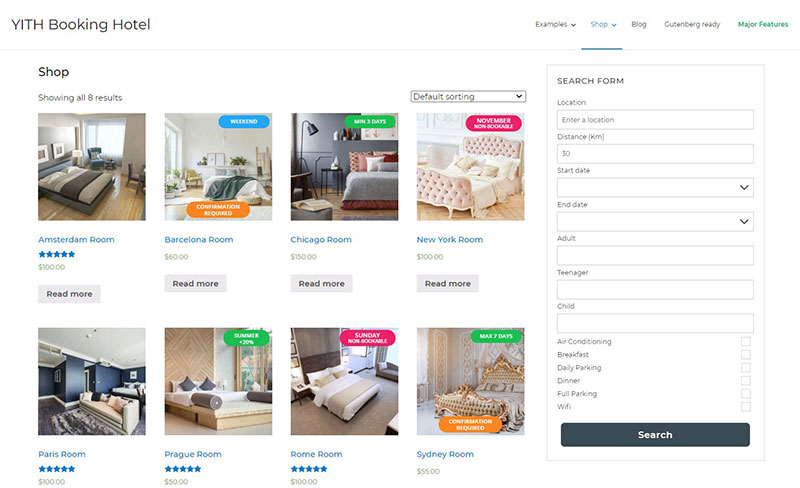
Where is `room photos`? The width and height of the screenshot is (800, 488). room photos is located at coordinates point(66,158), point(88,392), point(233,395), point(228,165), point(350,166), point(357,409), point(484,386), point(452,168).